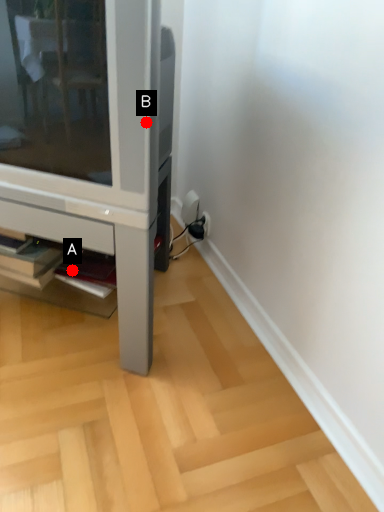
Question: Two points are circled on the image, labeled by A and B beside each circle. Which point appears farthest from the camera in this image?

Choices:
 (A) A is further
 (B) B is further

Answer: (A)